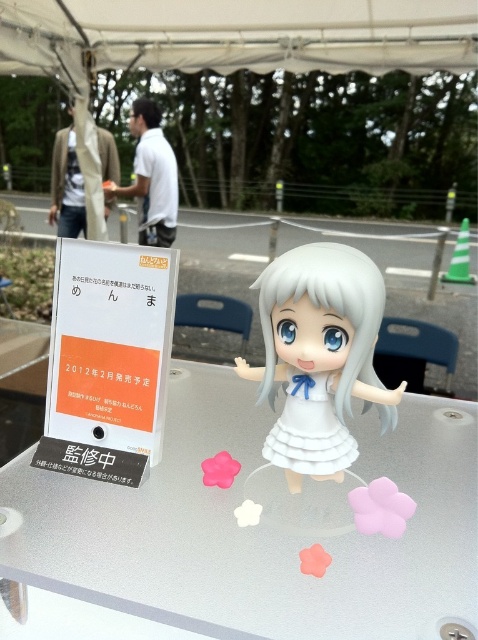
Question: Which point appears closest to the camera in this image?

Choices:
 (A) (321, 285)
 (B) (474, 38)

Answer: (A)

Question: Does white fabric canopy at upper center have a larger size compared to white glossy doll at center?

Choices:
 (A) no
 (B) yes

Answer: (B)

Question: Which point is farther to the camera?

Choices:
 (A) white matte dress at center
 (B) white fabric canopy at upper center
 (C) white glossy doll at center
 (D) transparent acrylic table at center

Answer: (B)

Question: Does transparent acrylic table at center appear over white fabric canopy at upper center?

Choices:
 (A) no
 (B) yes

Answer: (A)

Question: Which point appears farthest from the camera in this image?

Choices:
 (A) (268, 422)
 (B) (324, 397)
 (C) (258, 67)

Answer: (C)

Question: Can you confirm if white fabric canopy at upper center is thinner than white glossy doll at center?

Choices:
 (A) no
 (B) yes

Answer: (A)